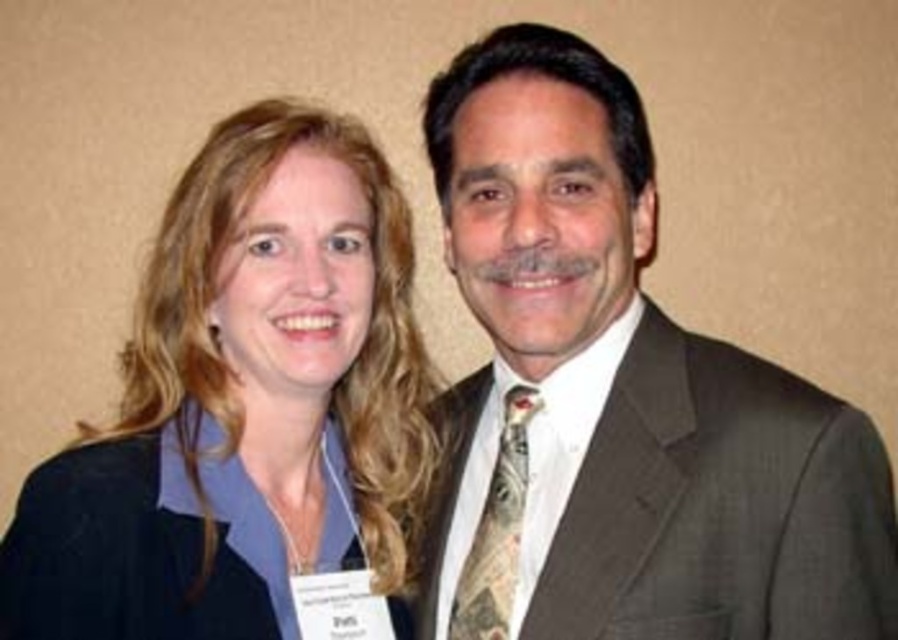
Is matte black blazer at center shorter than patterned silk tie at center?

No, matte black blazer at center is not shorter than patterned silk tie at center.

Where is `matte black blazer at center`? Image resolution: width=898 pixels, height=640 pixels. matte black blazer at center is located at coordinates (244, 404).

Who is positioned more to the left, dark brown suit at center or matte black blazer at center?

Positioned to the left is matte black blazer at center.

Is dark brown suit at center smaller than matte black blazer at center?

Yes, dark brown suit at center is smaller than matte black blazer at center.

Who is more forward, [507,339] or [24,515]?

Point [24,515] is in front.

Locate an element on the screen. This screenshot has width=898, height=640. dark brown suit at center is located at coordinates (619, 397).

Is point (639, 259) closer to viewer compared to point (473, 588)?

No, (639, 259) is behind (473, 588).

Is dark brown suit at center positioned at the back of patterned silk tie at center?

No, dark brown suit at center is closer to the viewer.

Find the location of `dark brown suit at center`. dark brown suit at center is located at coordinates (619, 397).

Image resolution: width=898 pixels, height=640 pixels. In order to click on dark brown suit at center in this screenshot , I will do `click(619, 397)`.